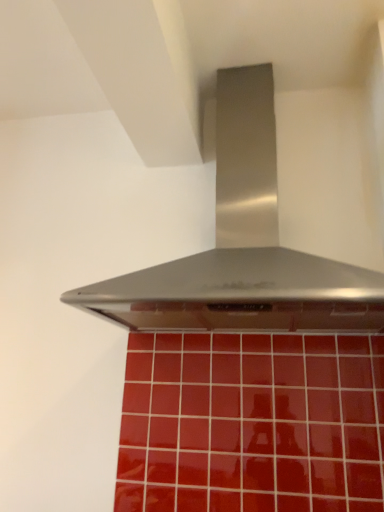
Question: Should I look upward or downward to see stainless steel range hood at center?

Choices:
 (A) up
 (B) down

Answer: (A)